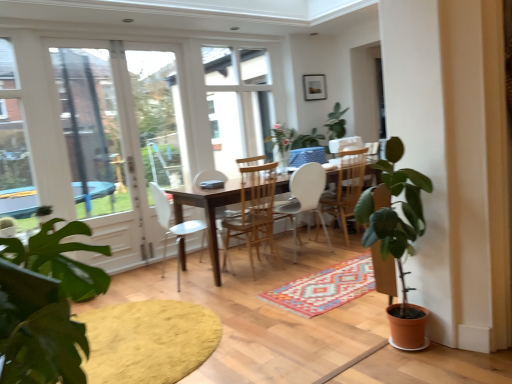
The image size is (512, 384). What are the coordinates of `empty space that is ontop of clear glass screen door at left` in the screenshot? It's located at (78, 33).